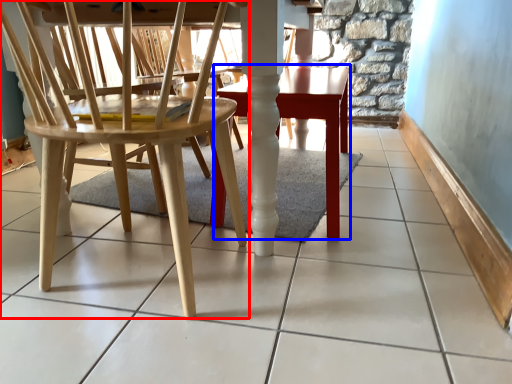
Question: Among these objects, which one is nearest to the camera, chair (highlighted by a red box) or table (highlighted by a blue box)?

Choices:
 (A) chair
 (B) table

Answer: (A)